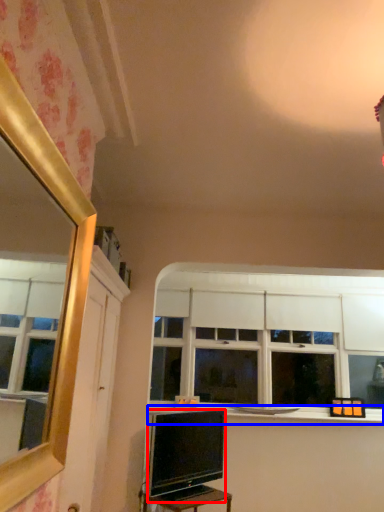
Question: Among these objects, which one is farthest to the camera, television (highlighted by a red box) or window sill (highlighted by a blue box)?

Choices:
 (A) television
 (B) window sill

Answer: (B)